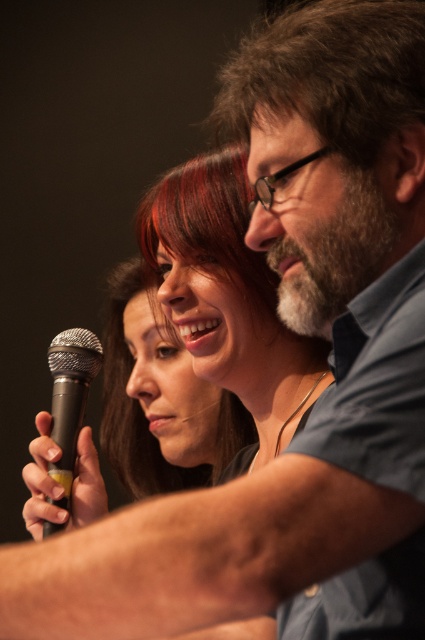
What are the coordinates of the matte black microphone at center?

The matte black microphone at center is located at coordinates point (163,384).